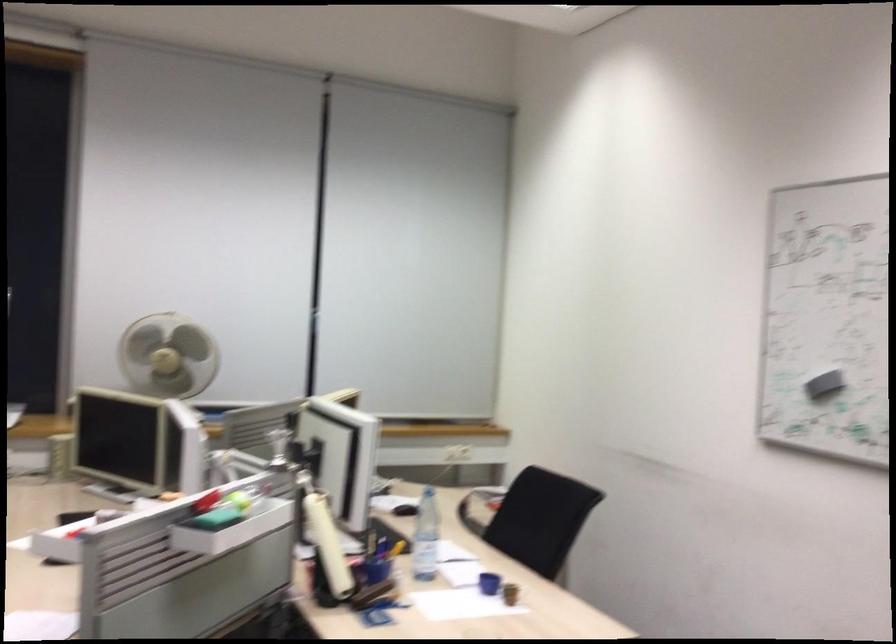
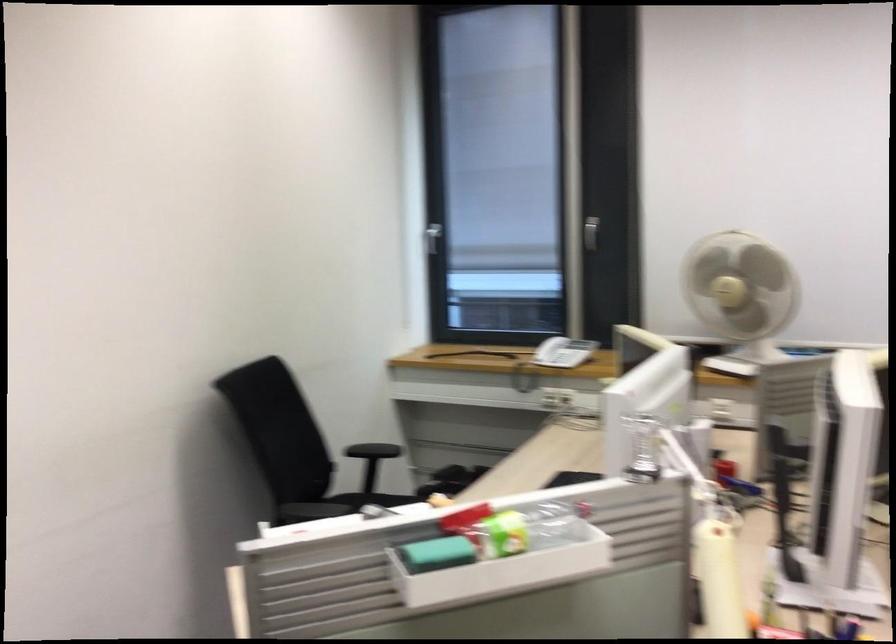
Find the pixel in the second image that matches (x=171, y=374) in the first image.

(741, 290)